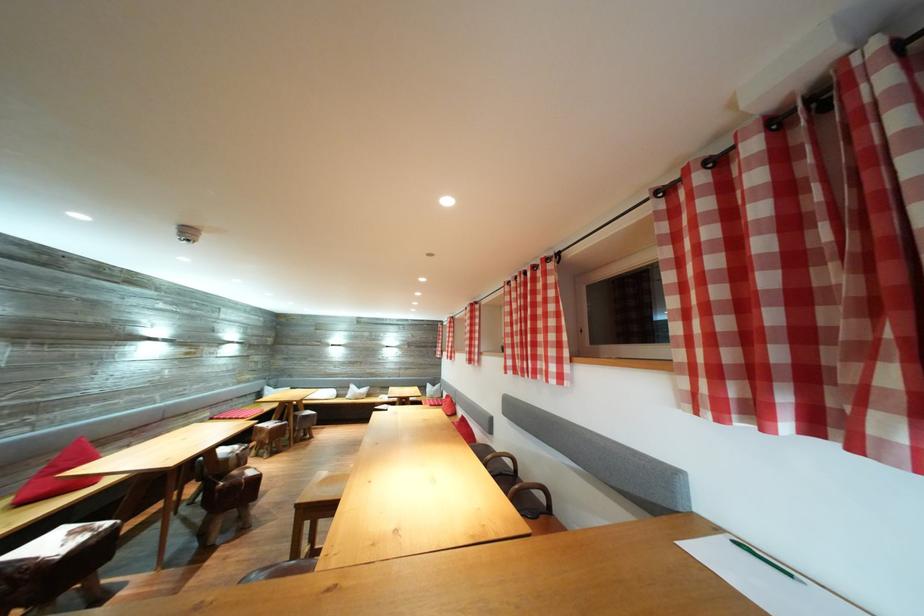
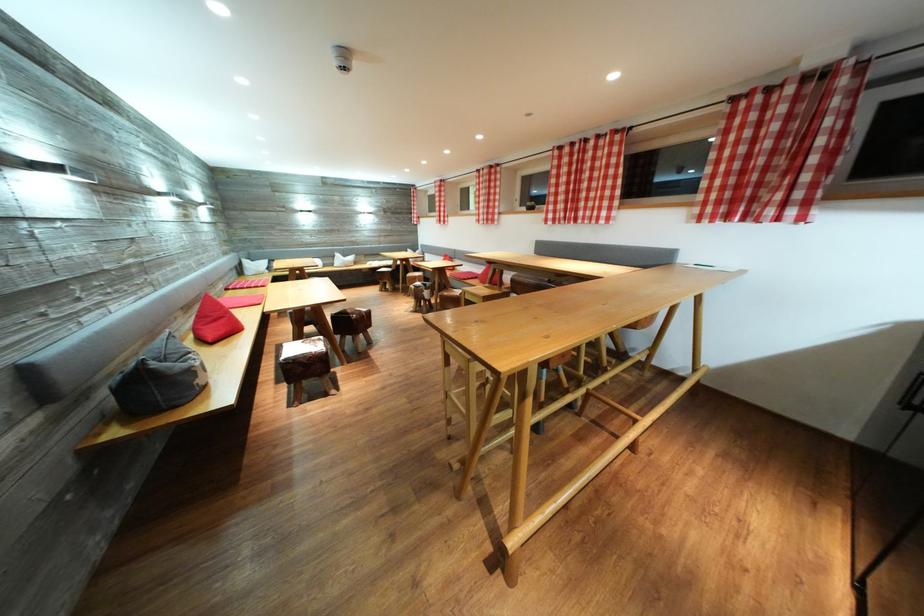
Find the pixel in the second image that matches [840,282] in the first image.

(787, 167)